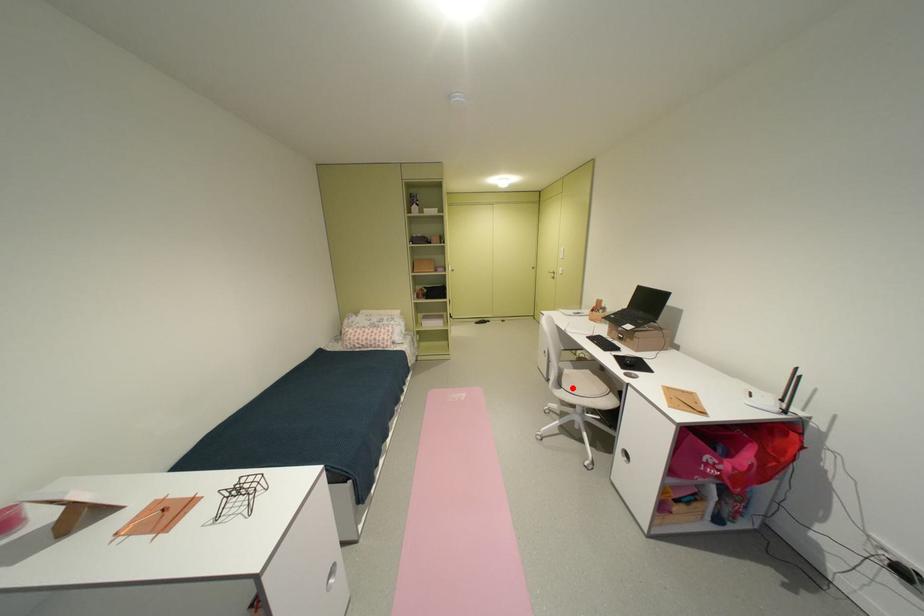
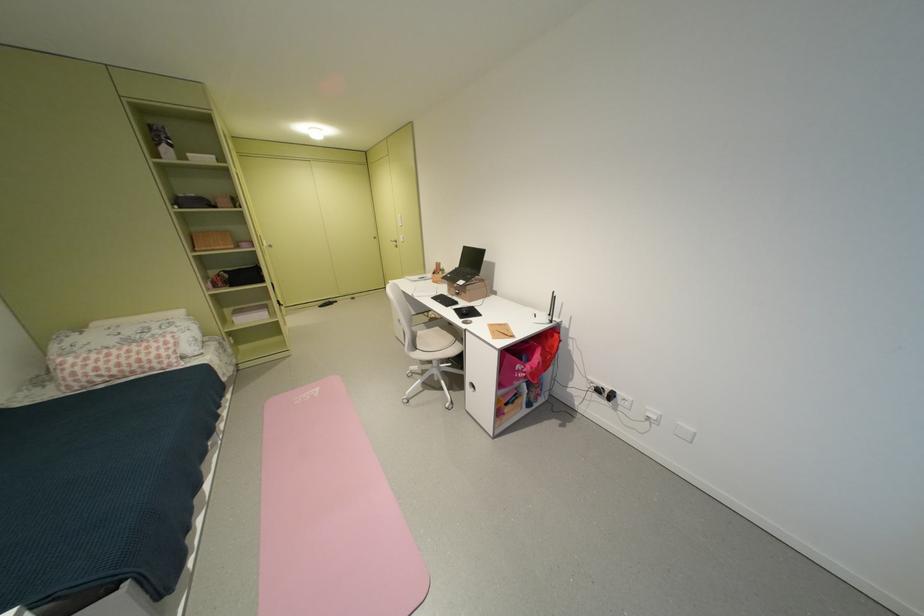
Find the pixel in the second image that matches the highlighted location in the first image.

(428, 349)